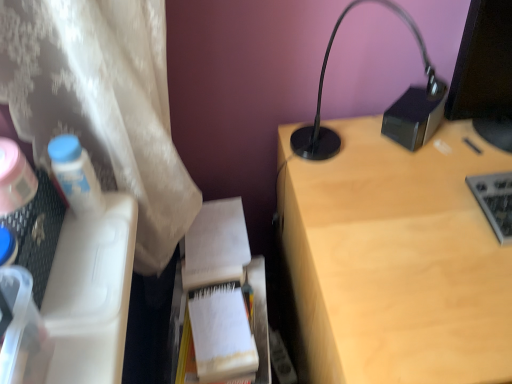
Find the location of `vacant space to the right of black metallic lamp at upper right`. vacant space to the right of black metallic lamp at upper right is located at coordinates click(x=421, y=172).